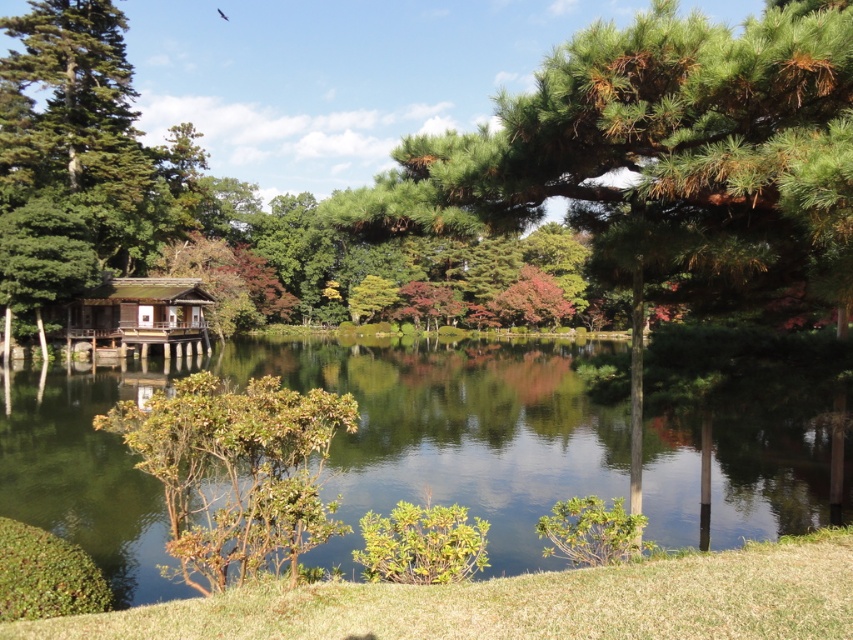
Can you confirm if green needle-like pine tree at center is smaller than green leafy bush at center?

No.

Does point (842, 269) come in front of point (292, 518)?

No, it is behind (292, 518).

You are a GUI agent. You are given a task and a screenshot of the screen. Output one action in this format:
    pyautogui.click(x=<x>, y=<y>)
    Task: Click on the green needle-like pine tree at center
    The width and height of the screenshot is (853, 640).
    Given the screenshot: What is the action you would take?
    click(x=660, y=163)

Is point (387, 365) positioned behind point (189, 513)?

Yes, it is behind point (189, 513).

Can you confirm if green glossy water at center is shorter than green leafy bush at center?

No.

The image size is (853, 640). What do you see at coordinates (453, 432) in the screenshot?
I see `green glossy water at center` at bounding box center [453, 432].

Identify the location of green glossy water at center. (453, 432).

Does green glossy water at center have a smaller size compared to wooden hut at center?

No, green glossy water at center is not smaller than wooden hut at center.

What do you see at coordinates (453, 432) in the screenshot?
I see `green glossy water at center` at bounding box center [453, 432].

Is point (851, 422) positioned in front of point (184, 280)?

Yes, point (851, 422) is in front of point (184, 280).

The image size is (853, 640). Find the location of `green glossy water at center`. green glossy water at center is located at coordinates (453, 432).